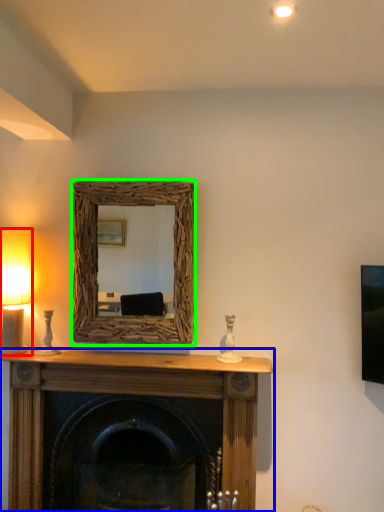
Question: Considering the real-world distances, which object is closest to table lamp (highlighted by a red box)? fireplace (highlighted by a blue box) or picture frame (highlighted by a green box).

Choices:
 (A) fireplace
 (B) picture frame

Answer: (B)